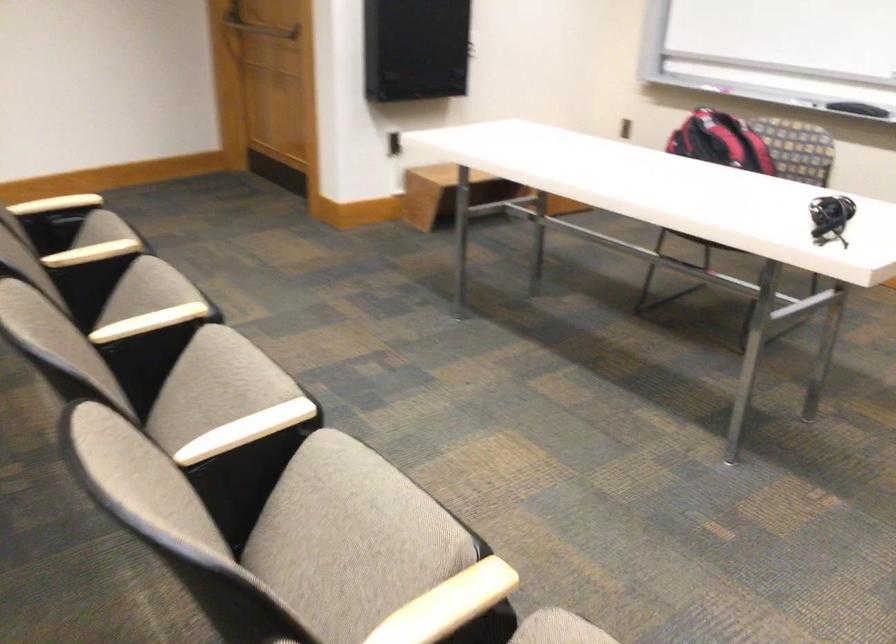
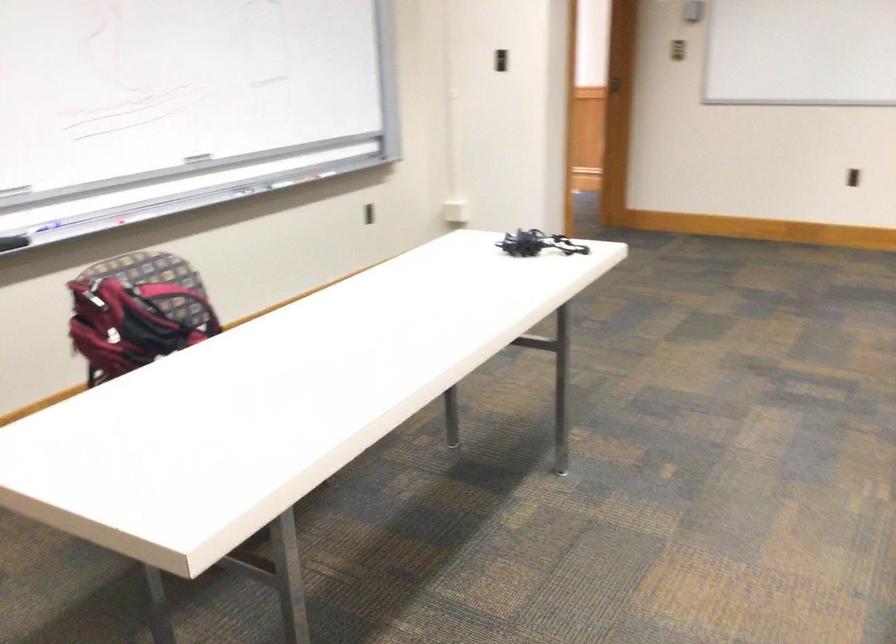
Locate, in the second image, the point that corresponds to [813,166] in the first image.

(177, 301)